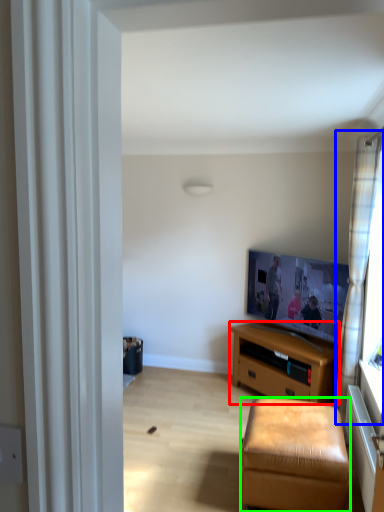
Question: Based on their relative distances, which object is farther from desk (highlighted by a red box)? Choose from curtain (highlighted by a blue box) and stool (highlighted by a green box).

Choices:
 (A) curtain
 (B) stool

Answer: (B)